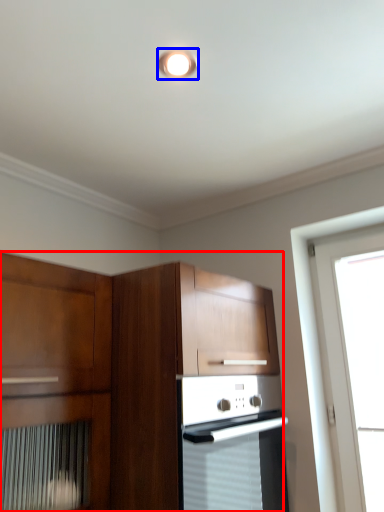
Question: Among these objects, which one is nearest to the camera, cabinetry (highlighted by a red box) or light fixture (highlighted by a blue box)?

Choices:
 (A) cabinetry
 (B) light fixture

Answer: (A)